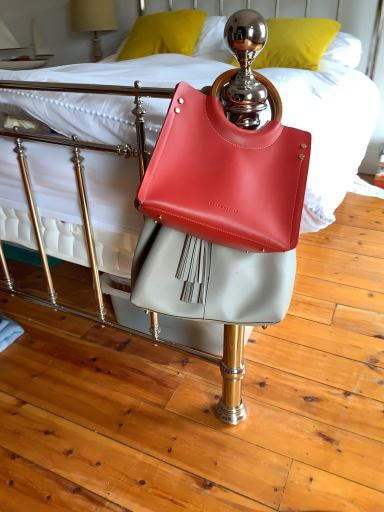
Question: In the image, is metallic gold pillow at upper center, acting as the second pillow starting from the left, on the left side or the right side of matte leather handbag at center?

Choices:
 (A) right
 (B) left

Answer: (A)

Question: Is metallic gold pillow at upper center, acting as the 1th pillow starting from the right, in front of or behind matte leather handbag at center in the image?

Choices:
 (A) behind
 (B) front

Answer: (A)

Question: Considering the real-world distances, which object is closest to the matte leather handbag at center?

Choices:
 (A) matte yellow pillow at upper center, which is counted as the second pillow, starting from the right
 (B) matte beige lampshade at upper left
 (C) metallic gold pillow at upper center, acting as the second pillow starting from the left

Answer: (C)

Question: Which object is the farthest from the metallic gold pillow at upper center, acting as the 1th pillow starting from the right?

Choices:
 (A) matte beige lampshade at upper left
 (B) matte yellow pillow at upper center, which is counted as the second pillow, starting from the right
 (C) matte leather handbag at center

Answer: (C)